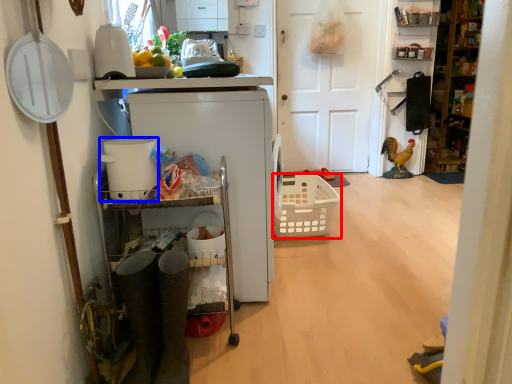
Question: Which point is closer to the camera, basket (highlighted by a red box) or appliance (highlighted by a blue box)?

Choices:
 (A) basket
 (B) appliance

Answer: (B)